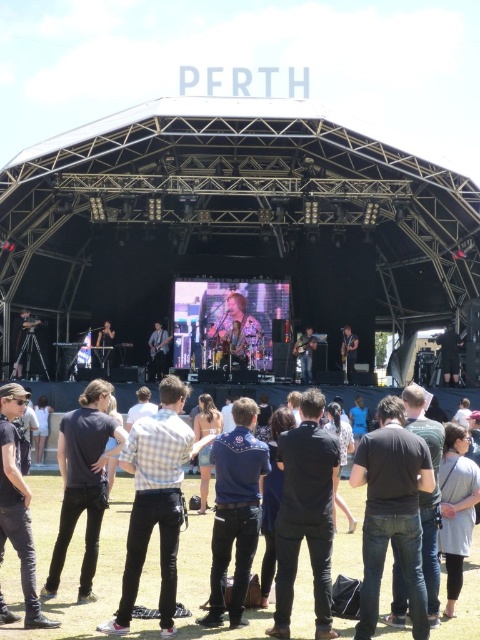
Question: Which of the following is the closest to the observer?

Choices:
 (A) shiny gold microphone at center
 (B) checkered fabric shirt at center
 (C) matte black guitar at center

Answer: (B)

Question: Is black matte shirt at center to the right of matte black tripod at lower left from the viewer's perspective?

Choices:
 (A) yes
 (B) no

Answer: (A)

Question: Which point is farther to the camera?

Choices:
 (A) denim jeans at center
 (B) dark blue shirt at center

Answer: (B)

Question: Which point appears closest to the camera in this image?

Choices:
 (A) (104, 369)
 (B) (152, 362)
 (C) (229, 307)
 (D) (352, 483)

Answer: (D)

Question: Where is denim jeans at center located in relation to black leather jacket at lower right in the image?

Choices:
 (A) right
 (B) left

Answer: (B)

Question: Is denim jeans at center thinner than black denim jeans at center?

Choices:
 (A) yes
 (B) no

Answer: (B)